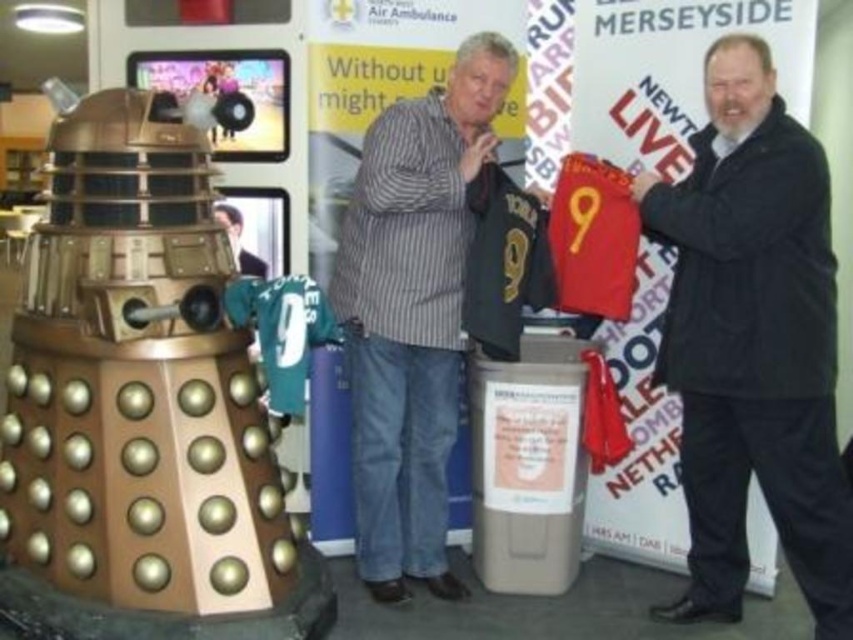
You are a photographer at the event and need to capture a group photo of the dark gray jacket at center and smooth black shirt at center. The camera you are using has a minimum focusing distance of 6 feet. Will you be able to take a clear photo of both subjects without moving either of them?

The distance between the dark gray jacket at center and smooth black shirt at center is 6.50 feet, which is greater than the camera minimum focusing distance of 6 feet. Therefore, you can take a clear photo of both subjects without moving them.

You are standing in front of the Dalek model at the exhibition. You need to place a new decorative item at the exact center of the dark gray jacket at center. Where should you place it?

The dark gray jacket at center is already located at the center point, so placing the decorative item there would be appropriate.

You are organizing a charity event and need to display two items from the scene. The dark gray jacket at center and the smooth black shirt at center must be placed on a rack. Which item requires a larger hanger?

The dark gray jacket at center requires a larger hanger because it has a larger size compared to the smooth black shirt at center.